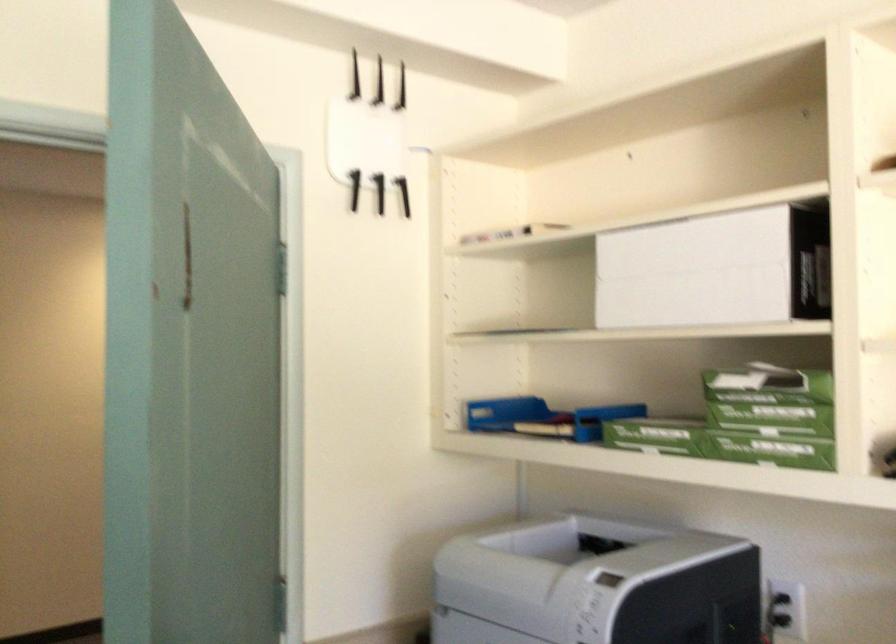
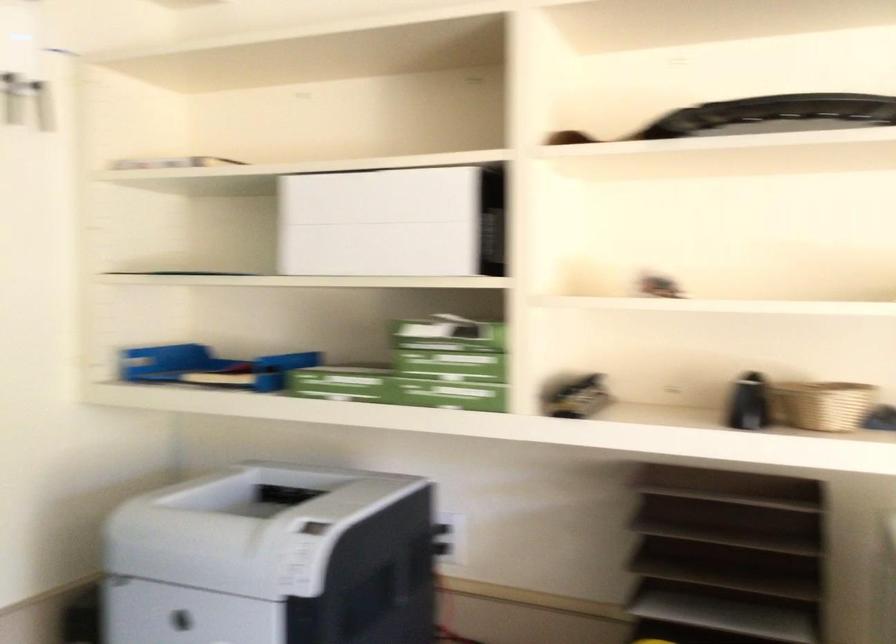
In the scene shown: The images are taken continuously from a first-person perspective. In which direction are you moving?

The movement direction of the cameraman is left, forward.